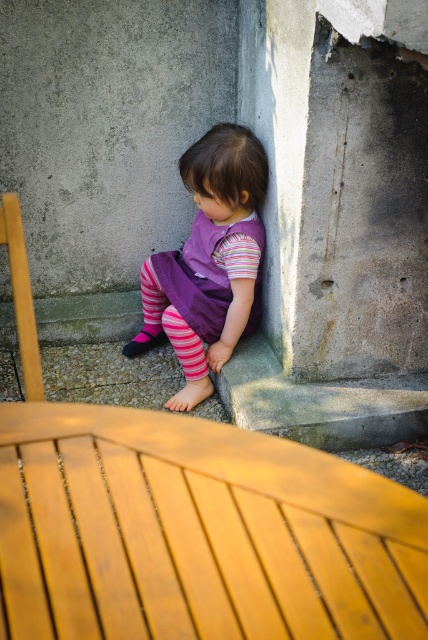
Is purple cotton dress at center closer to the viewer compared to pink striped sock at lower center?

No, it is behind pink striped sock at lower center.

Is purple cotton dress at center below pink striped sock at lower center?

Actually, purple cotton dress at center is above pink striped sock at lower center.

Between point (196, 284) and point (184, 324), which one is positioned in front?

Point (184, 324) is in front.

What are the coordinates of `purple cotton dress at center` in the screenshot? It's located at (192, 292).

Is purple fabric dress at lower center to the right of pink striped sock at lower center from the viewer's perspective?

Yes, purple fabric dress at lower center is to the right of pink striped sock at lower center.

Describe the element at coordinates (210, 260) in the screenshot. The image size is (428, 640). I see `purple fabric dress at lower center` at that location.

Does point (216, 132) come closer to viewer compared to point (193, 356)?

Yes, point (216, 132) is in front of point (193, 356).

Find the location of a particular element. This screenshot has width=428, height=640. purple fabric dress at lower center is located at coordinates (210, 260).

Which is more to the left, purple fabric dress at lower center or purple cotton dress at center?

From the viewer's perspective, purple fabric dress at lower center appears more on the left side.

The width and height of the screenshot is (428, 640). Identify the location of purple fabric dress at lower center. (210, 260).